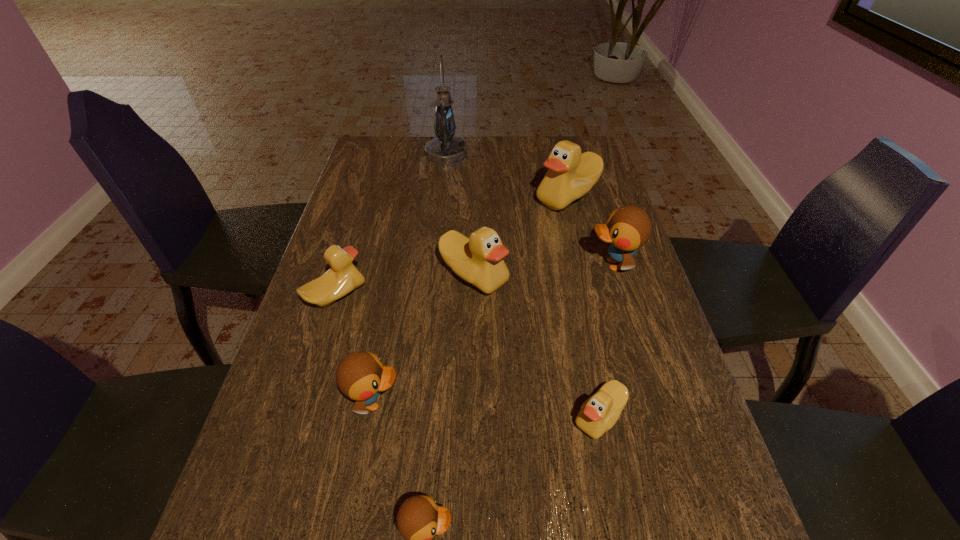
Where is `the farthest object`? This screenshot has width=960, height=540. the farthest object is located at coordinates (445, 149).

You are a GUI agent. You are given a task and a screenshot of the screen. Output one action in this format:
    pyautogui.click(x=<x>, y=<y>)
    Task: Click on the oil lamp
    The height and width of the screenshot is (540, 960).
    Given the screenshot: What is the action you would take?
    pyautogui.click(x=445, y=149)

Identify the location of the seventh nearest object. This screenshot has height=540, width=960. (571, 174).

You are a GUI agent. You are given a task and a screenshot of the screen. Output one action in this format:
    pyautogui.click(x=<x>, y=<y>)
    Task: Click on the farthest beige duck
    This screenshot has height=540, width=960.
    Given the screenshot: What is the action you would take?
    pyautogui.click(x=571, y=174)

Where is `the rightmost blue duck`? the rightmost blue duck is located at coordinates (628, 228).

Where is `the farthest blue duck`? the farthest blue duck is located at coordinates (628, 228).

In order to click on the second biggest beige duck in this screenshot , I will do (478, 260).

The width and height of the screenshot is (960, 540). Find the location of `the second nearest blue duck`. the second nearest blue duck is located at coordinates coord(361,376).

The image size is (960, 540). I want to click on the leftmost blue duck, so click(361, 376).

Locate an element on the screen. The width and height of the screenshot is (960, 540). the leftmost duck is located at coordinates (343, 277).